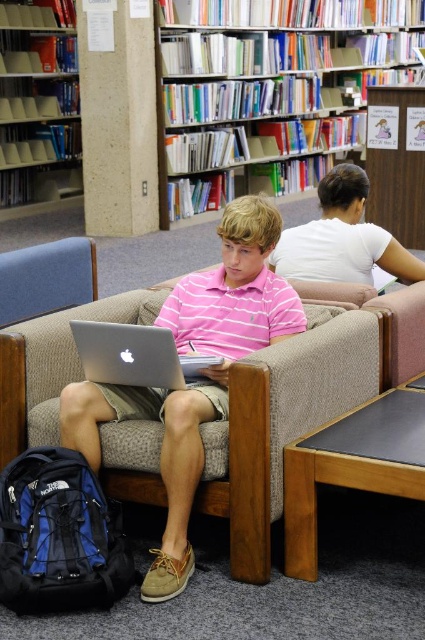
You are standing in the library and want to know how far the point at coordinates (371,61) is from you. Can you determine the distance?

The point at coordinates (371,61) is 8.46 meters away from you.

You are a librarian who needs to move a 3.5 feet wide bookshelf from the storage to the library. The new location must be between the white glossy bookshelf at upper center and the matte plastic bookshelf at upper left. Can you fit the bookshelf there?

The white glossy bookshelf at upper center is 7.91 feet from the matte plastic bookshelf at upper left. Since the new bookshelf is 3.5 feet wide, there is enough space between them to fit it as 7.91 feet is greater than 3.5 feet.

You are standing in the library and want to borrow a book from the shelf behind the beige fabric couch at center and the silver metallic laptop at center. Which object should you move first to reach the shelf?

You should move the beige fabric couch at center first because it is closer to you than the silver metallic laptop at center, so it blocks your path more directly.